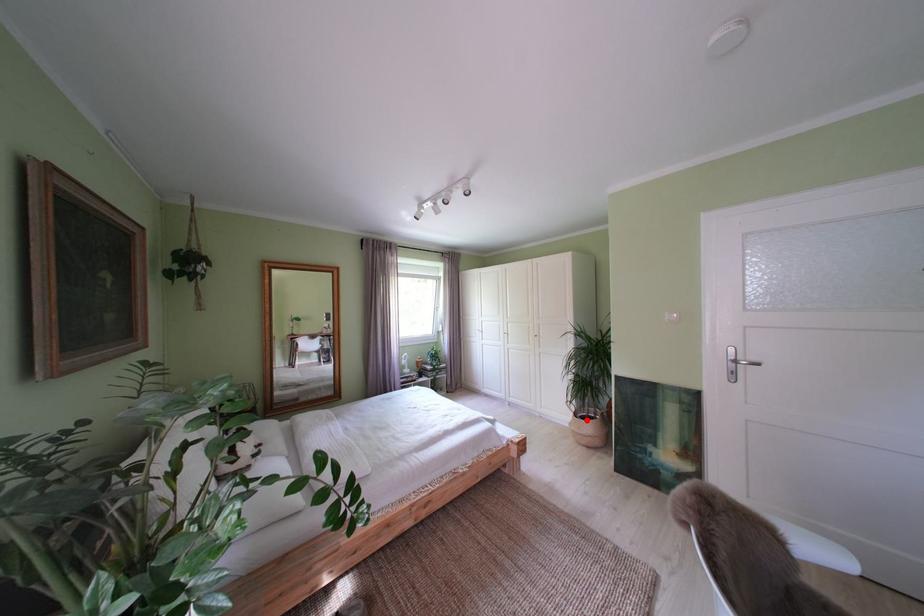
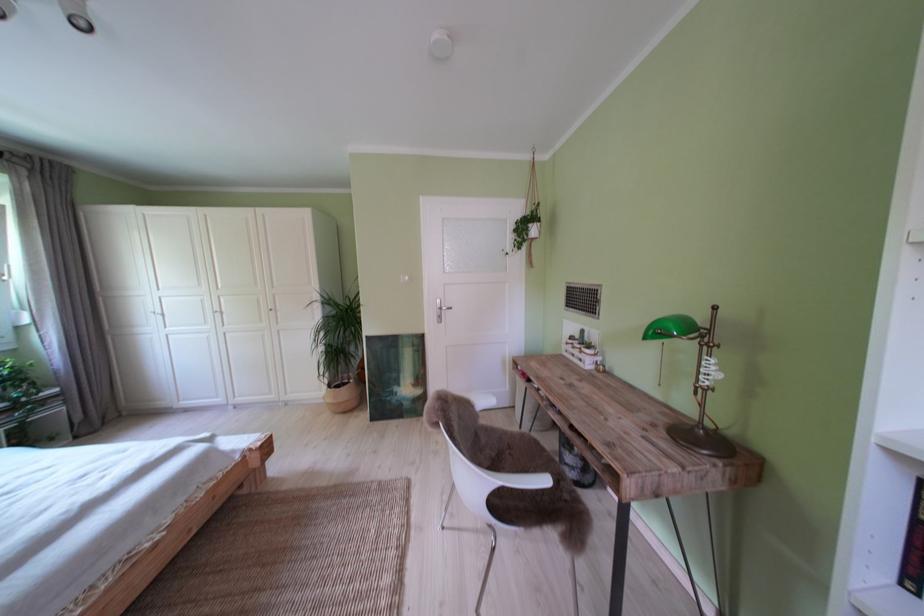
Question: A red point is marked in image1. In image2, is the corresponding 3D point closer to the camera or farther? Reply with the corresponding letter.

Choices:
 (A) The corresponding 3D point is closer.
 (B) The corresponding 3D point is farther.

Answer: (A)